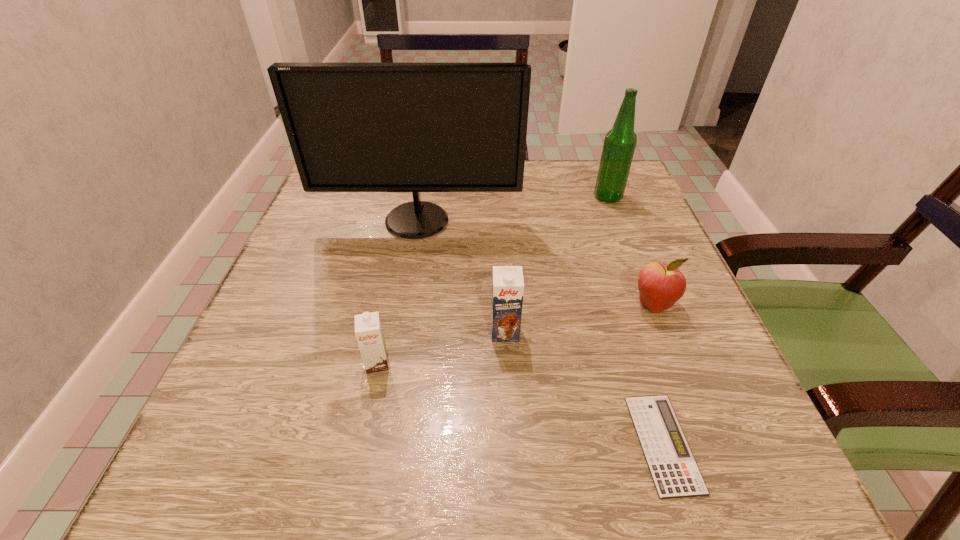
This screenshot has width=960, height=540. I want to click on free location that satisfies the following two spatial constraints: 1. on the label of the beer bottle; 2. on the front side of the fifth farthest object, so click(x=672, y=363).

Locate an element on the screen. free spot that satisfies the following two spatial constraints: 1. on the label of the beer bottle; 2. on the front-facing side of the tallest object is located at coordinates (617, 221).

The width and height of the screenshot is (960, 540). I want to click on free spot that satisfies the following two spatial constraints: 1. on the front-facing side of the apple; 2. on the left side of the computer monitor, so click(x=402, y=304).